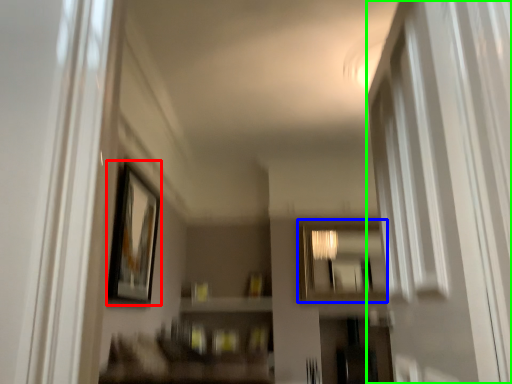
Question: Which is nearer to the picture frame (highlighted by a red box)? mirror (highlighted by a blue box) or screen door (highlighted by a green box).

Choices:
 (A) mirror
 (B) screen door

Answer: (B)